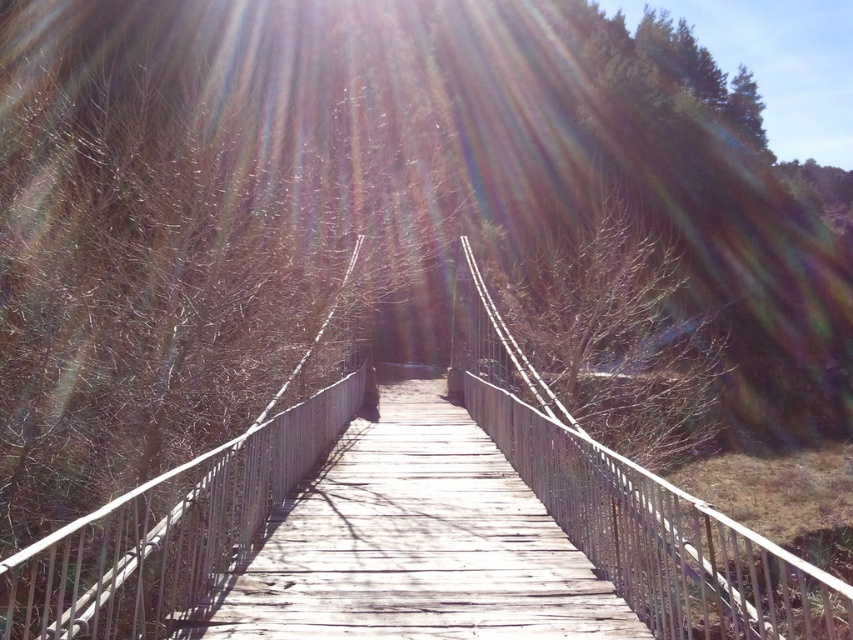
Question: Which point appears farthest from the camera in this image?

Choices:
 (A) (349, 372)
 (B) (409, 577)
 (C) (708, 380)

Answer: (C)

Question: Can you confirm if wooden at center is positioned to the left of weathered wood bridge at center?

Choices:
 (A) no
 (B) yes

Answer: (A)

Question: In this image, where is wooden at center located relative to bare branches at center?

Choices:
 (A) above
 (B) below

Answer: (B)

Question: Which object is the closest to the wooden at center?

Choices:
 (A) weathered wood bridge at center
 (B) bare branches at center

Answer: (A)

Question: Does wooden at center appear on the left side of bare branches at center?

Choices:
 (A) yes
 (B) no

Answer: (A)

Question: Which object appears closest to the camera in this image?

Choices:
 (A) wooden at center
 (B) weathered wood bridge at center
 (C) bare branches at center

Answer: (A)